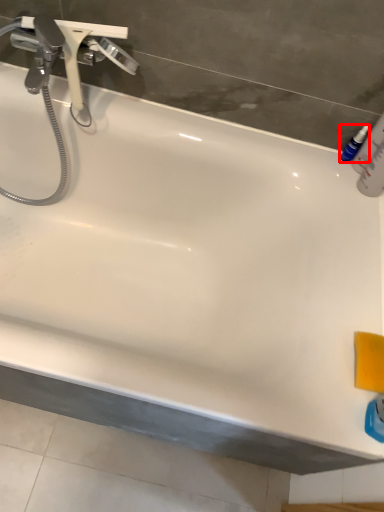
Question: From the image's perspective, considering the relative positions of mouthwash (annotated by the red box) and tap in the image provided, where is mouthwash (annotated by the red box) located with respect to the staircase?

Choices:
 (A) above
 (B) below

Answer: (B)